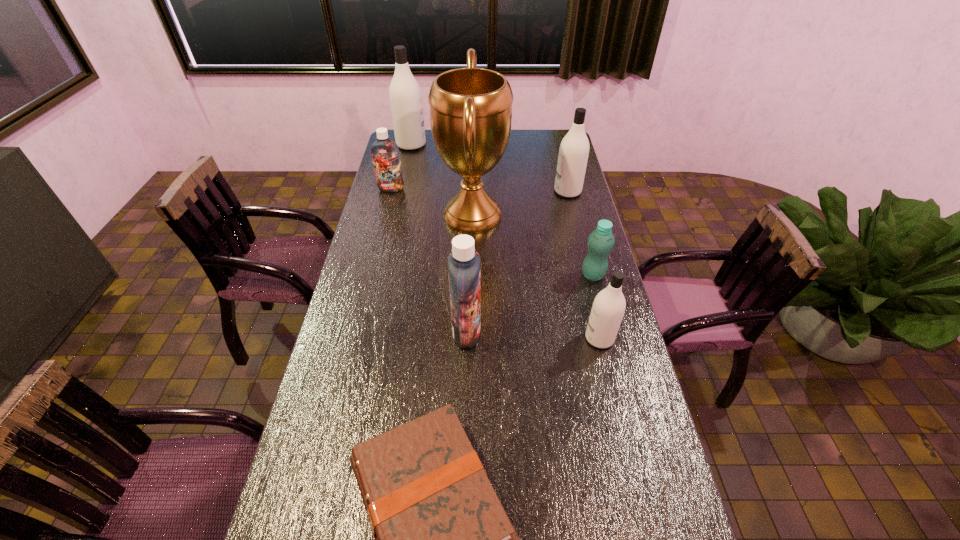
This screenshot has width=960, height=540. I want to click on vacant space that is in between the gold trophy cup and the water bottle, so click(533, 245).

You are a GUI agent. You are given a task and a screenshot of the screen. Output one action in this format:
    pyautogui.click(x=<x>, y=<y>)
    Task: Click on the blank region between the trophy cup and the seventh tallest object
    Image resolution: width=960 pixels, height=540 pixels.
    Given the screenshot: What is the action you would take?
    pyautogui.click(x=533, y=245)

I want to click on vacant region between the second farthest white shampoo and the water bottle, so click(580, 233).

I want to click on free space between the nearest white shampoo and the third shampoo from right to left, so click(x=533, y=335).

At what (x,y) coordinates should I click in order to perform the action: click on free point between the second smallest white shampoo and the tallest object. Please return your answer as a coordinate pair (x, y). Looking at the image, I should click on (520, 204).

Identify which object is the fourth closest to the trophy cup. Please provide its 2D coordinates. Your answer should be formatted as a tuple, i.e. [(x, y)], where the tuple contains the x and y coordinates of a point satisfying the conditions above.

[(601, 241)]

Locate an element on the screen. object that can be found as the fourth closest to the water bottle is located at coordinates (573, 154).

What are the coordinates of `shampoo that is the third closest to the biggest white shampoo` in the screenshot? It's located at (464, 262).

Point out which shampoo is positioned as the second nearest to the fifth farthest object. Please provide its 2D coordinates. Your answer should be formatted as a tuple, i.e. [(x, y)], where the tuple contains the x and y coordinates of a point satisfying the conditions above.

[(464, 262)]

Point out which white shampoo is positioned as the nearest to the farthest shampoo. Please provide its 2D coordinates. Your answer should be formatted as a tuple, i.e. [(x, y)], where the tuple contains the x and y coordinates of a point satisfying the conditions above.

[(573, 154)]